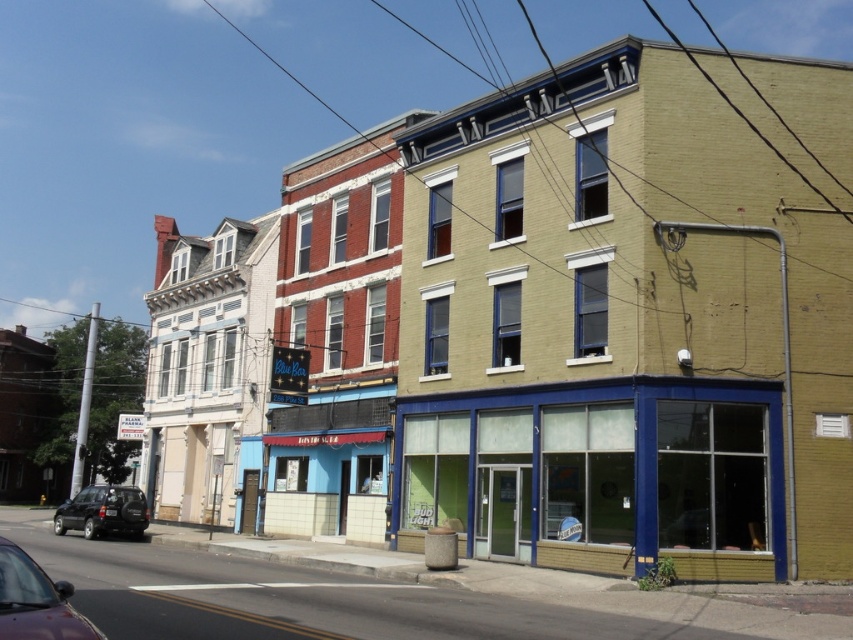
You are standing at the point labeled as point (625, 326). Looking around, you see the yellow brick building at center. Which direction should you face to see the building with the Blue Bar sign?

You should face to the left to see the building with the Blue Bar sign because the Blue Bar sign is on the building to the left of the yellow brick building at center.

You are standing on the sidewalk and see the yellow brick building at center and the shiny maroon sedan at lower left. Which object is closer to you?

The yellow brick building at center is closer to you because it is further to the viewer than the shiny maroon sedan at lower left.